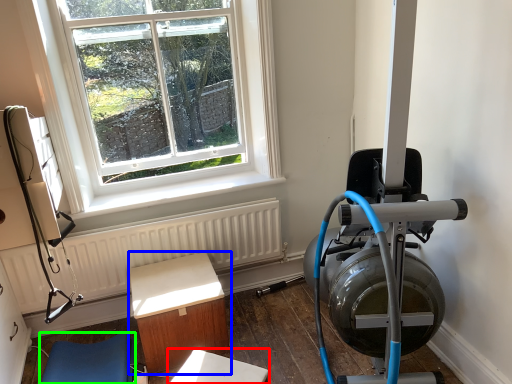
Question: Based on their relative distances, which object is farther from table (highlighted by a red box)? Choose from furniture (highlighted by a blue box) and furniture (highlighted by a green box).

Choices:
 (A) furniture
 (B) furniture

Answer: (B)